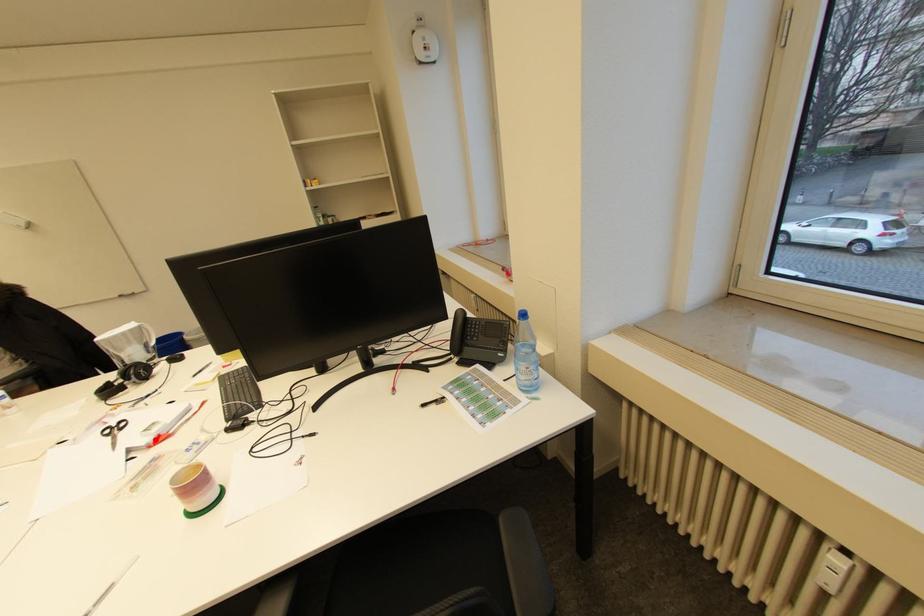
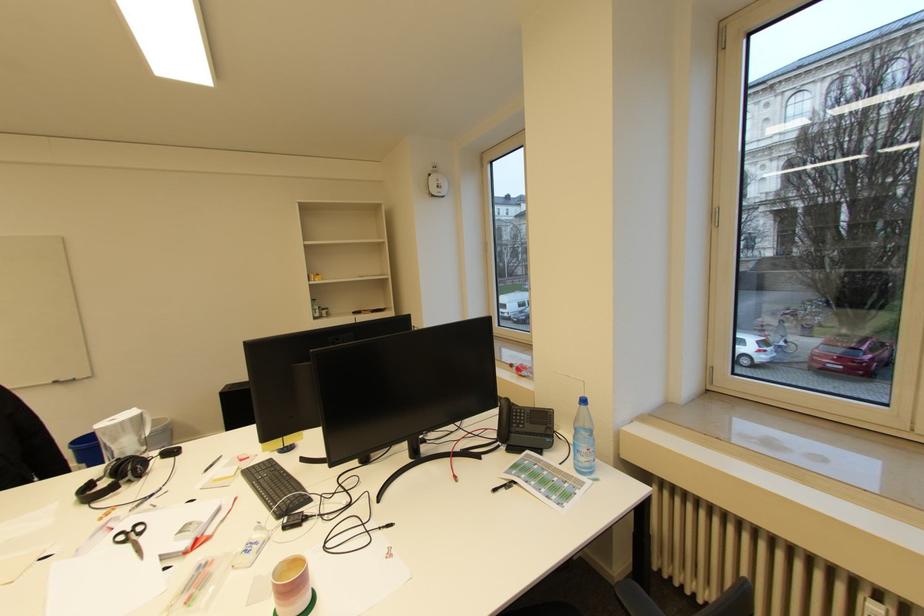
Locate, in the second image, the point that corresponds to the highlighted location in the first image.

(192, 544)